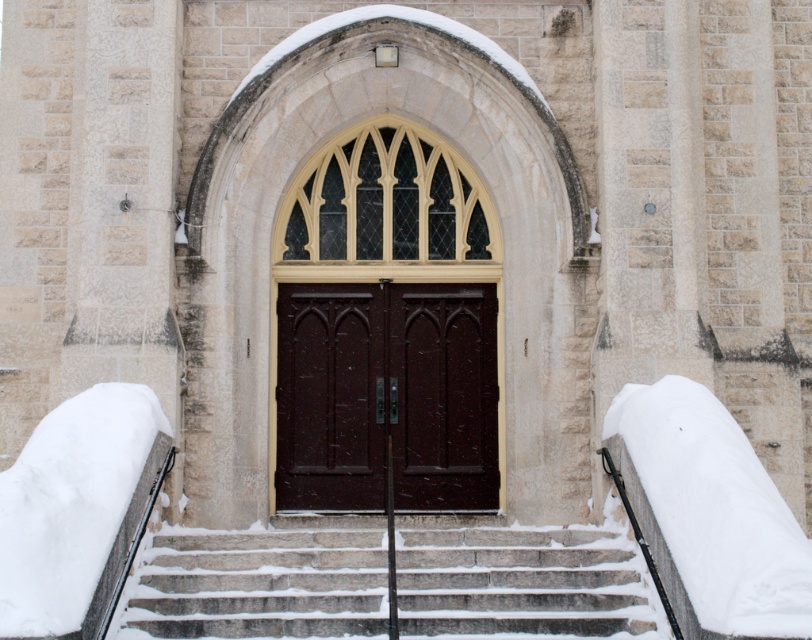
You are standing at the entrance of a church and see two points marked on the stone wall. The first point is at coordinates point (555, 563) and the second is at point (335, 500). Which point is closer to you?

Point (555, 563) is closer to the viewer than point (335, 500).

You are a delivery person carrying a heavy package and need to enter the building. The gray stone stairs at center and the dark wood doors at center are in your path. Which object is shorter and would allow you to step over it without needing to climb?

The gray stone stairs at center has a lesser height compared to dark wood doors at center, so you can step over the gray stone stairs at center since it is shorter.